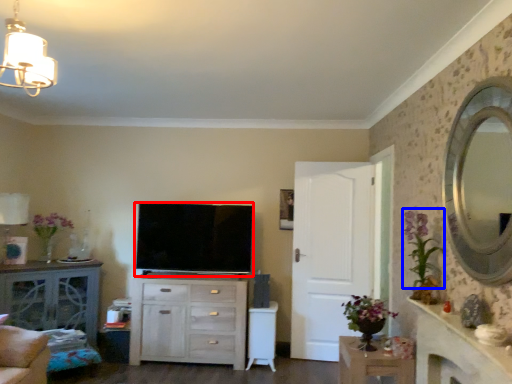
Question: Which point is further to the camera, television (highlighted by a red box) or floral arrangement (highlighted by a blue box)?

Choices:
 (A) television
 (B) floral arrangement

Answer: (A)